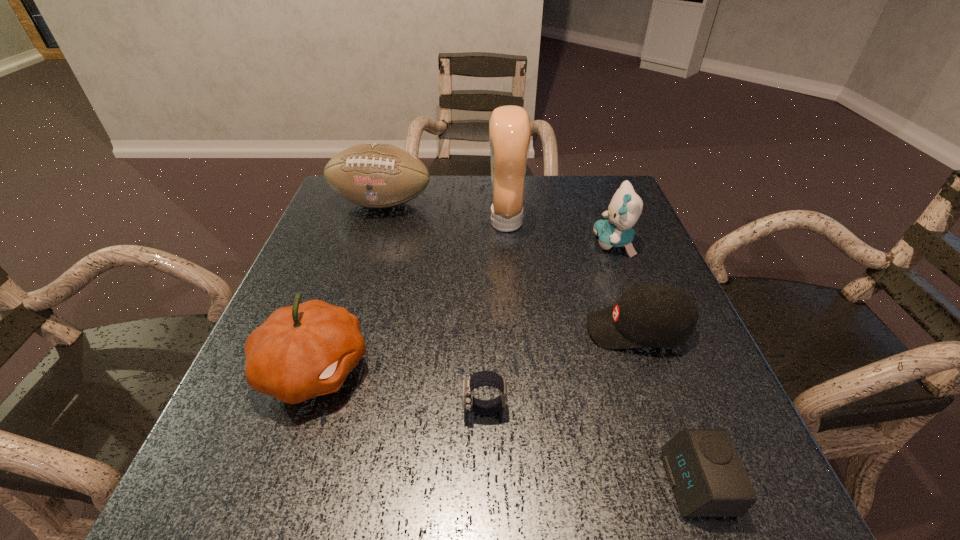
This screenshot has width=960, height=540. I want to click on the tallest object, so click(x=509, y=126).

In order to click on football (American) in this screenshot , I will do `click(375, 175)`.

In order to click on kitten in this screenshot , I will do `click(625, 208)`.

Image resolution: width=960 pixels, height=540 pixels. Find the location of `pumpkin`. pumpkin is located at coordinates (306, 350).

Find the location of a particular element. Image resolution: width=960 pixels, height=540 pixels. the fifth tallest object is located at coordinates (651, 314).

In order to click on watch in this screenshot , I will do `click(482, 378)`.

Find the location of `the shortest object`. the shortest object is located at coordinates (708, 479).

Locate an element on the screen. This screenshot has width=960, height=540. alarm clock is located at coordinates pos(708,479).

The height and width of the screenshot is (540, 960). Find the location of `free space located on the label of the condiment`. free space located on the label of the condiment is located at coordinates (380, 222).

Image resolution: width=960 pixels, height=540 pixels. What are the coordinates of `vacant space positioned 0.230m on the label of the condiment` in the screenshot? It's located at (399, 222).